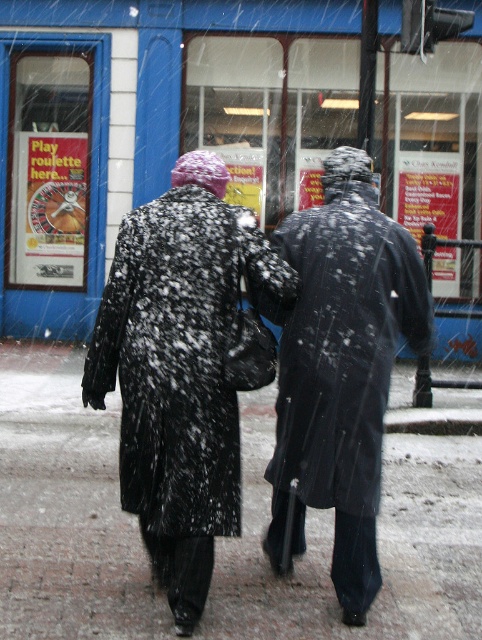
Question: Observing the image, what is the correct spatial positioning of blue glass window at center in reference to snow-covered concrete at center?

Choices:
 (A) right
 (B) left

Answer: (A)

Question: Which of the following is the closest to the observer?

Choices:
 (A) snow-covered concrete at center
 (B) snow-covered coat at center
 (C) black matte coat at center

Answer: (B)

Question: Is blue glass window at center closer to camera compared to snow-covered coat at center?

Choices:
 (A) yes
 (B) no

Answer: (B)

Question: Which point is closer to the camera taking this photo?

Choices:
 (A) (310, 564)
 (B) (372, 330)

Answer: (B)

Question: Which of the following is the closest to the observer?

Choices:
 (A) (12, 596)
 (B) (58, 80)
 (C) (330, 208)

Answer: (C)

Question: Is blue glass window at center to the right of black matte coat at center from the viewer's perspective?

Choices:
 (A) no
 (B) yes

Answer: (A)